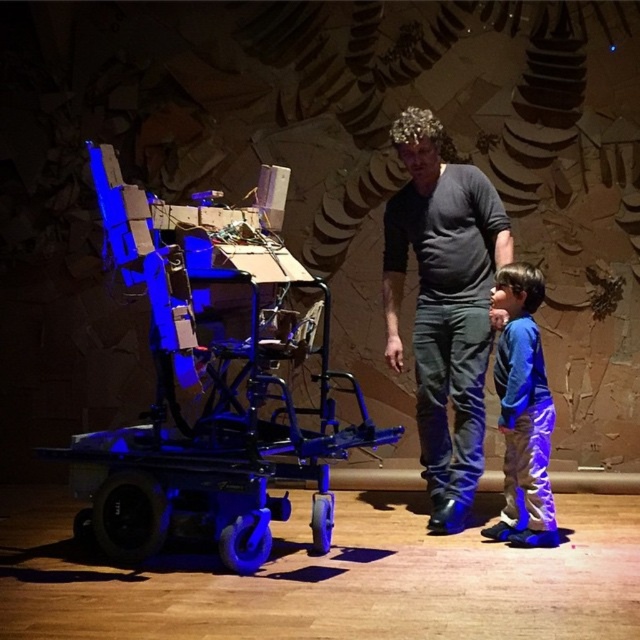
Does dark gray t-shirt at center appear over blue cotton shirt at center?

Yes, dark gray t-shirt at center is above blue cotton shirt at center.

Does point (442, 452) lie in front of point (529, 516)?

No, (442, 452) is behind (529, 516).

You are a GUI agent. You are given a task and a screenshot of the screen. Output one action in this format:
    pyautogui.click(x=<x>, y=<y>)
    Task: Click on the dark gray t-shirt at center
    The image size is (640, 640).
    Given the screenshot: What is the action you would take?
    pyautogui.click(x=444, y=305)